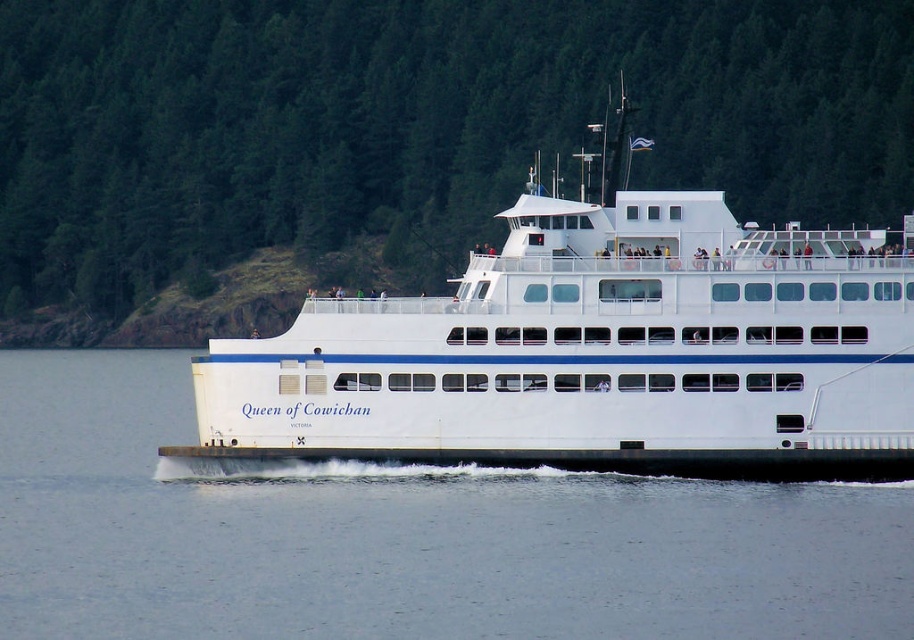
Who is higher up, white water at center or white smooth ferry at center?

Positioned higher is white smooth ferry at center.

Is white water at center smaller than white smooth ferry at center?

Indeed, white water at center has a smaller size compared to white smooth ferry at center.

Where is `white water at center`? The width and height of the screenshot is (914, 640). white water at center is located at coordinates click(402, 536).

Identify the location of white water at center. (402, 536).

Who is shorter, green textured trees at upper center or white water at center?

With less height is white water at center.

In the scene shown: Between green textured trees at upper center and white water at center, which one is positioned higher?

green textured trees at upper center is above.

Which is in front, point (222, 52) or point (809, 554)?

Point (809, 554)

This screenshot has width=914, height=640. I want to click on green textured trees at upper center, so click(x=412, y=124).

Can you confirm if green textured trees at upper center is positioned to the left of white smooth ferry at center?

Result: Correct, you'll find green textured trees at upper center to the left of white smooth ferry at center.

Image resolution: width=914 pixels, height=640 pixels. I want to click on green textured trees at upper center, so click(x=412, y=124).

Does point (186, 120) come farther from viewer compared to point (861, 246)?

Yes, it is behind point (861, 246).

The width and height of the screenshot is (914, 640). Find the location of `green textured trees at upper center`. green textured trees at upper center is located at coordinates (412, 124).